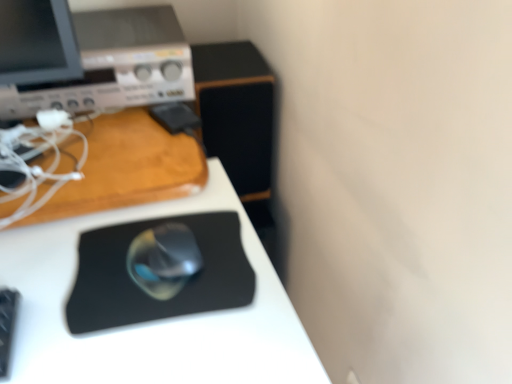
I want to click on vacant space underneath black rubber mousepad at center (from a real-world perspective), so click(x=162, y=270).